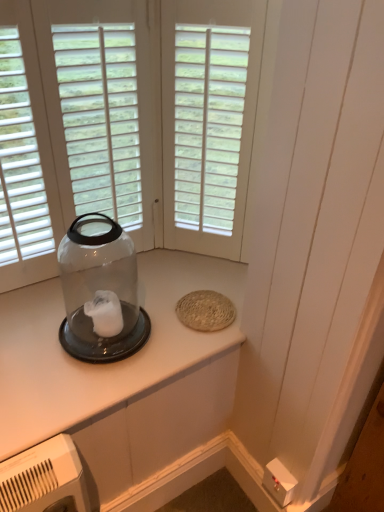
Find the location of `vacant area on top of clear plastic jar at upper left (from a real-world perspective)`. vacant area on top of clear plastic jar at upper left (from a real-world perspective) is located at coordinates (134, 304).